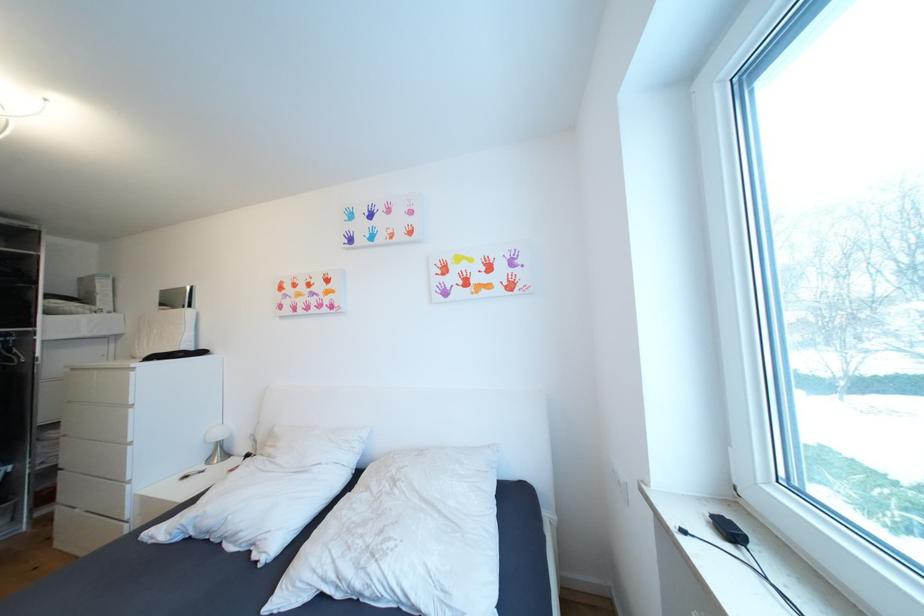
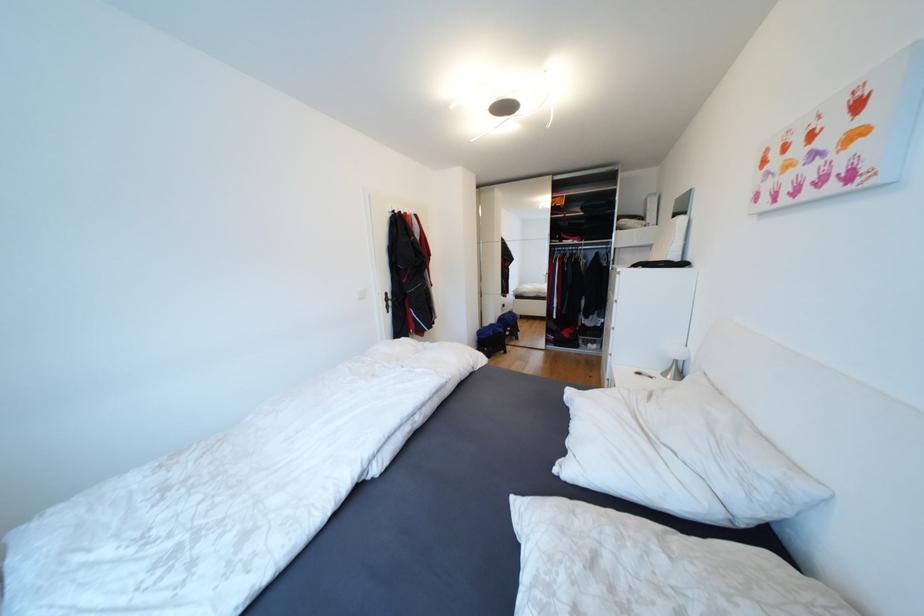
Find the pixel in the second image that matches pixel 148 546 in the first image.

(570, 394)